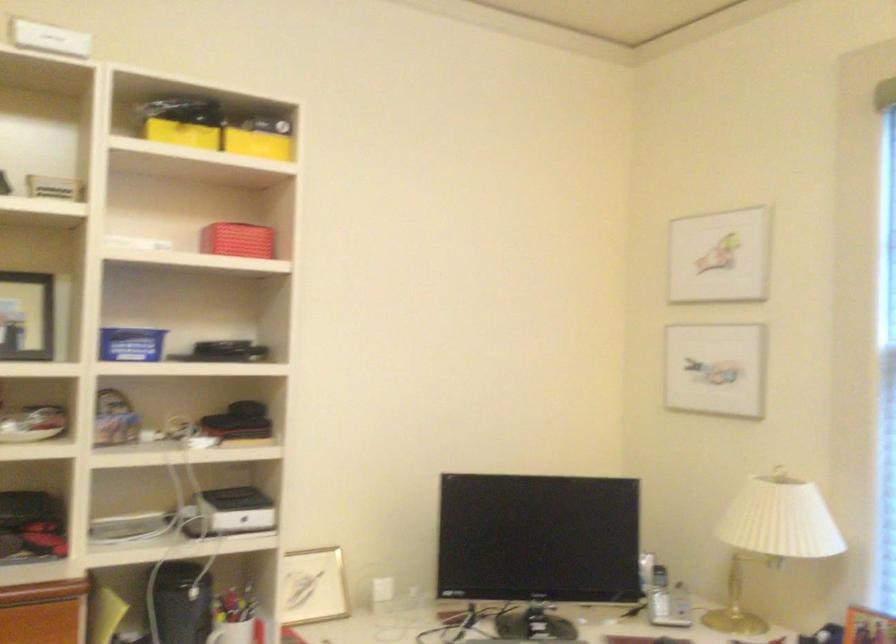
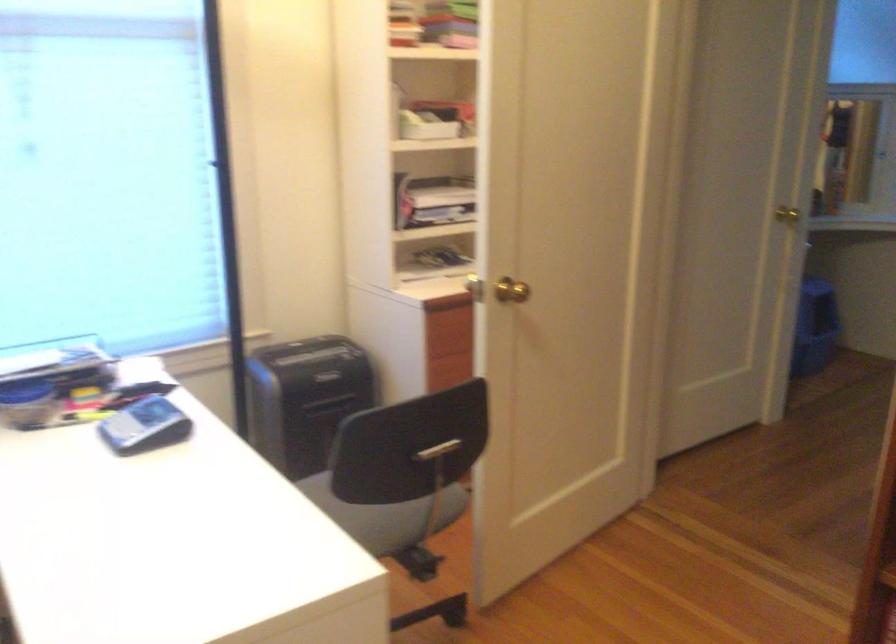
First-person continuous shooting, in which direction is the camera rotating?

The rotation direction of the camera is right-down.